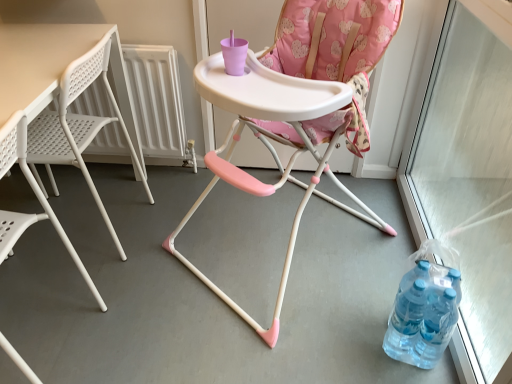
In order to click on free space between white plastic chair at left, which appears as the first chair when viewed from the left, and white plastic table at left in this screenshot , I will do `click(58, 279)`.